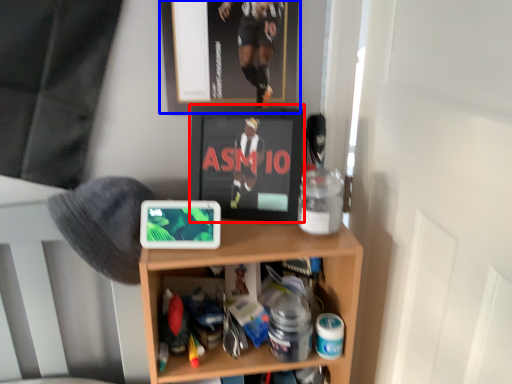
Question: Which point is closer to the camera, wide (highlighted by a red box) or picture frame (highlighted by a blue box)?

Choices:
 (A) wide
 (B) picture frame

Answer: (B)